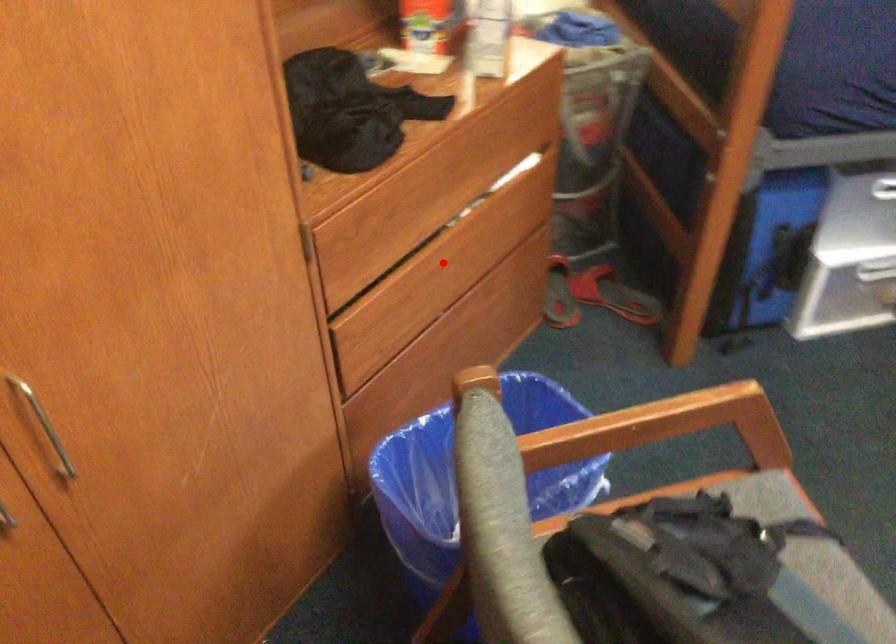
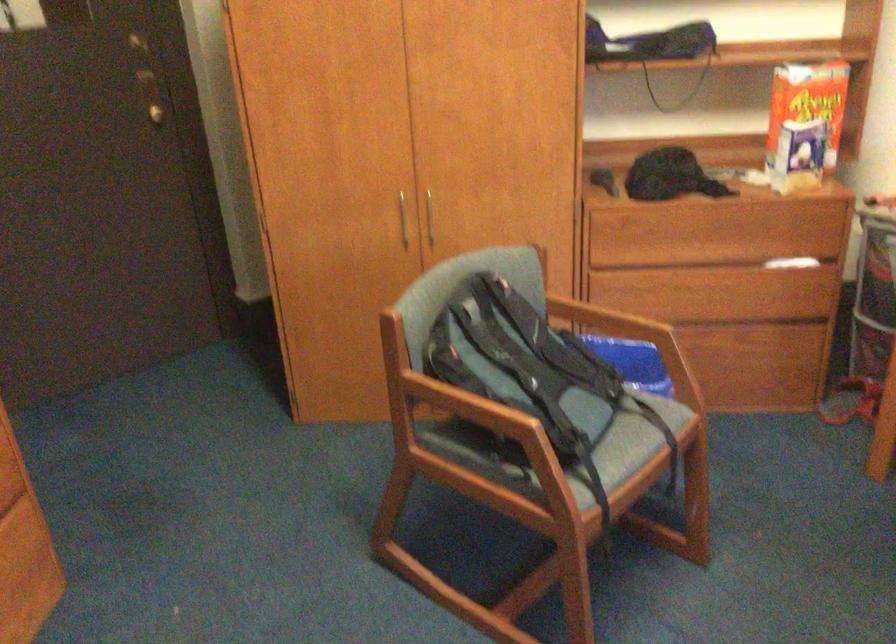
Question: I am providing you with two images of the same scene from different viewpoints. Given a red point in image1, look at the same physical point in image2. Is it:

Choices:
 (A) Closer to the viewpoint
 (B) Farther from the viewpoint

Answer: (B)